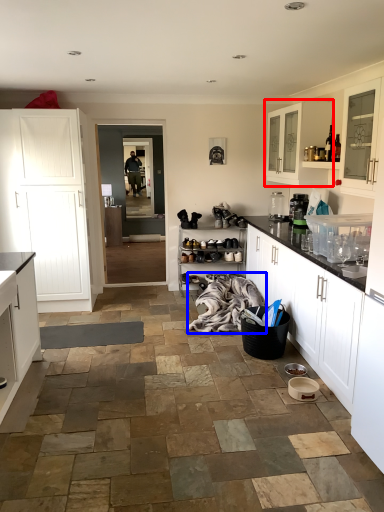
Question: Which point is further to the camera, cabinetry (highlighted by a red box) or blanket (highlighted by a blue box)?

Choices:
 (A) cabinetry
 (B) blanket

Answer: (A)